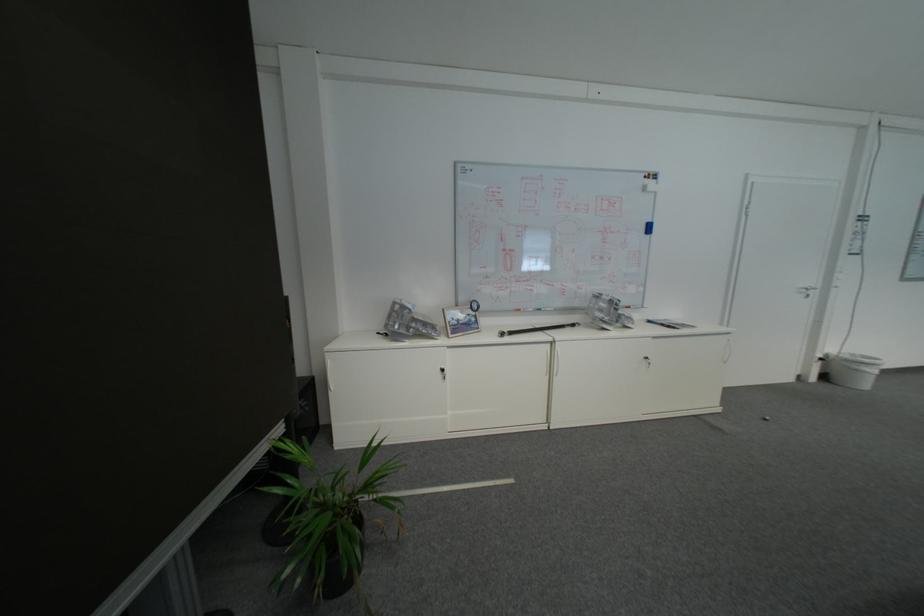
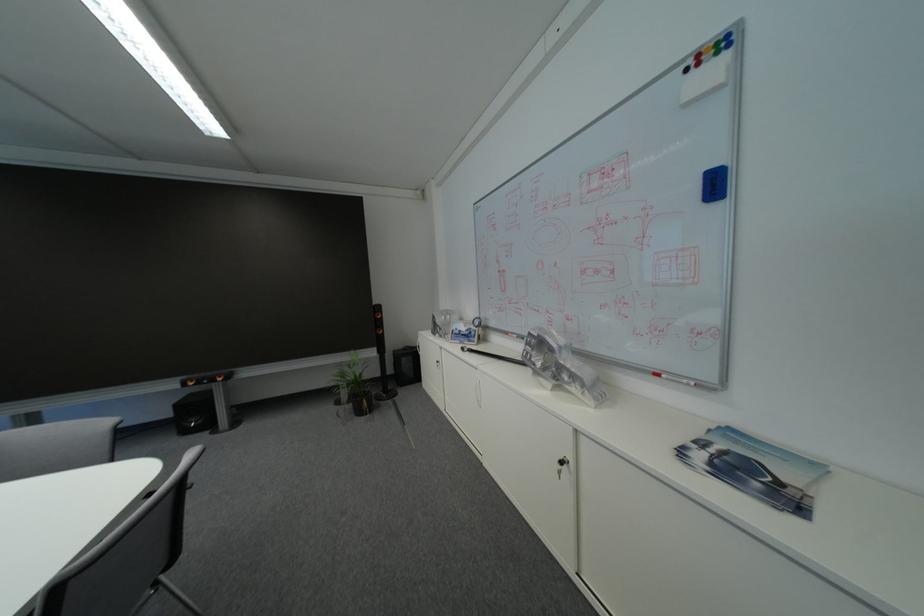
Locate, in the second image, the point that corresponds to [663,172] in the first image.

(723, 34)